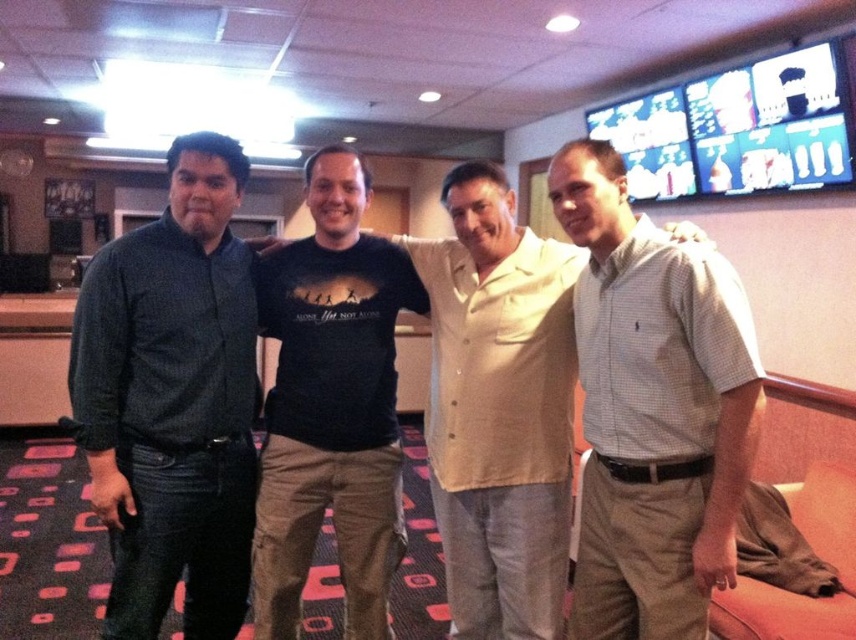
Question: Observing the image, what is the correct spatial positioning of dark blue shirt at left in reference to light beige shirt at center?

Choices:
 (A) above
 (B) below

Answer: (A)

Question: Among these objects, which one is farthest from the camera?

Choices:
 (A) light beige shirt at center
 (B) white checkered shirt at center
 (C) dark blue shirt at left
 (D) black cotton t-shirt at center

Answer: (D)

Question: Which point is farther from the camera taking this photo?

Choices:
 (A) (682, 502)
 (B) (293, 515)
 (C) (207, 536)
 (D) (453, 180)

Answer: (C)

Question: Is white checkered shirt at center to the left of light beige shirt at center from the viewer's perspective?

Choices:
 (A) yes
 (B) no

Answer: (B)

Question: Does dark blue shirt at left come behind light beige shirt at center?

Choices:
 (A) yes
 (B) no

Answer: (B)

Question: Among these objects, which one is nearest to the camera?

Choices:
 (A) light beige shirt at center
 (B) white checkered shirt at center
 (C) dark blue shirt at left
 (D) black cotton t-shirt at center

Answer: (B)